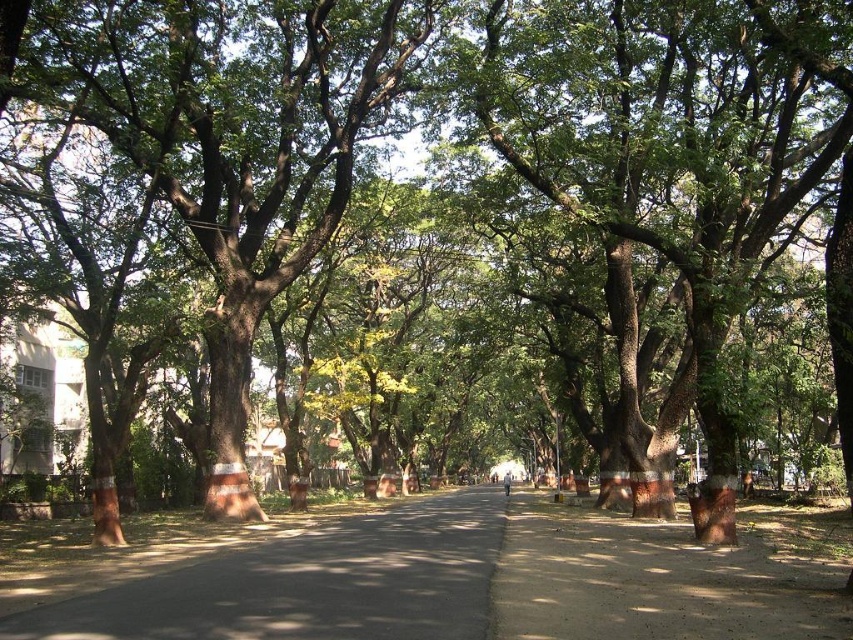
Looking at this image, you are a gardener planning to plant a new tree along the shaded pathway. The existing brown rough bark tree at center and the brown dirt pavement at center are in your way. Which object should you move to make space for the new tree?

The brown rough bark tree at center might be wider than the brown dirt pavement at center, so you should move the brown rough bark tree at center to make space for the new tree.

You are a cyclist riding a bike with a 1.2 meter wide load attached to the back. You see the dark asphalt road at center and the brown dirt pavement at center. Which path should you choose to safely pass through with your load?

The dark asphalt road at center might be wider than brown dirt pavement at center, so you should choose the dark asphalt road at center to safely pass through with your load since it is likely wider than the brown dirt pavement at center.

You are standing at the starting point of the pathway and want to reach the figures in the distance. Which direction should you move to stay on the dark asphalt road at center?

You should move straight ahead along the dark asphalt road at center, as it stretches straight towards the horizon where the figures are located.